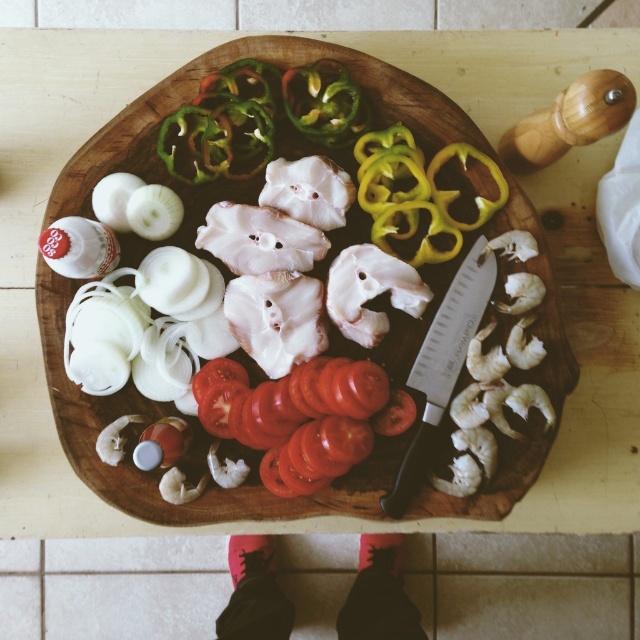
Question: Where is wooden cutting board at center located in relation to green glossy bell pepper at upper center in the image?

Choices:
 (A) below
 (B) above

Answer: (A)

Question: Can you confirm if silver metallic knife at center is positioned above green glossy bell pepper at upper center?

Choices:
 (A) no
 (B) yes

Answer: (A)

Question: Which point is closer to the camera?

Choices:
 (A) green glossy bell pepper at upper center
 (B) silver metallic knife at center
 (C) wooden cutting board at center

Answer: (A)

Question: Which object is closer to the camera taking this photo?

Choices:
 (A) wooden cutting board at center
 (B) silver metallic knife at center
 (C) green glossy bell pepper at upper center

Answer: (C)

Question: Can you confirm if wooden cutting board at center is bigger than green glossy bell pepper at upper center?

Choices:
 (A) no
 (B) yes

Answer: (B)

Question: Which point is farther to the camera?

Choices:
 (A) (516, 195)
 (B) (436, 388)
 (C) (364, 120)

Answer: (C)